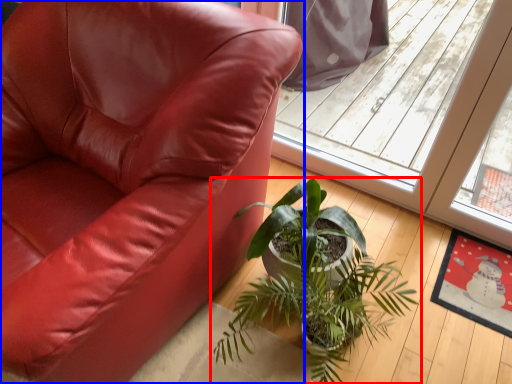
Question: Which object is closer to the camera taking this photo, houseplant (highlighted by a red box) or chair (highlighted by a blue box)?

Choices:
 (A) houseplant
 (B) chair

Answer: (B)